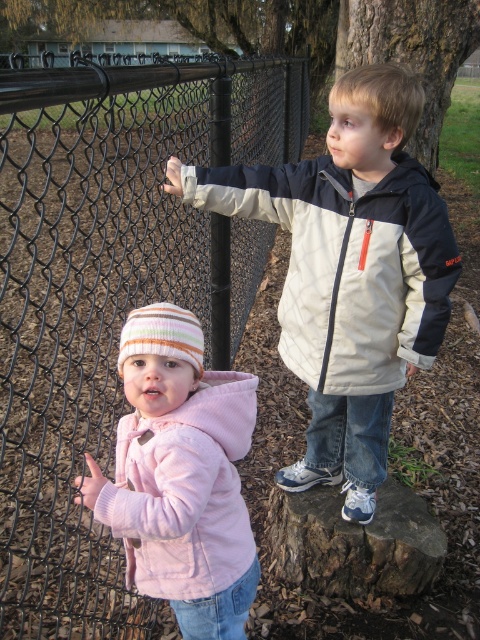
You are a photographer trying to capture the perfect shot of the light beige jacket at upper right. According to the coordinates provided, where should you position your camera to ensure the jacket is centered in the frame?

To center the light beige jacket at upper right in the frame, position your camera so that the center of the viewfinder aligns with the coordinates point (x=348, y=266).

You are a drone operator trying to capture a photo of both the light beige jacket at upper right and the pink fleece jacket at lower left. Which jacket should you focus on first to ensure both are in frame?

You should focus on the light beige jacket at upper right first because it is closer to you than the pink fleece jacket at lower left, ensuring both are in frame.